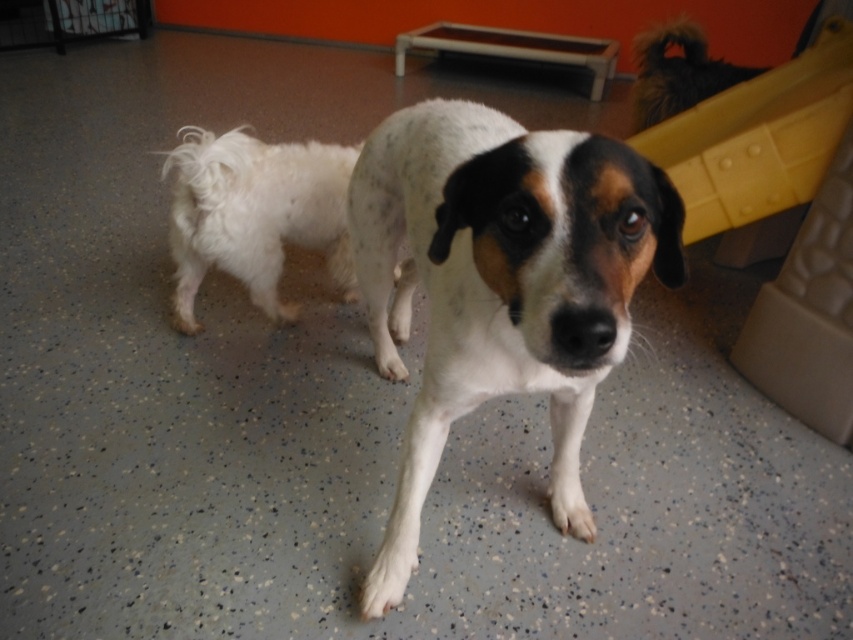
Who is higher up, white speckled fur dog at center or yellow plastic slide at upper right?

yellow plastic slide at upper right

Does point (463, 228) come behind point (776, 193)?

No.

Image resolution: width=853 pixels, height=640 pixels. Identify the location of white speckled fur dog at center. (500, 284).

Can you confirm if white fluffy dog at left is positioned to the left of yellow plastic slide at upper right?

Indeed, white fluffy dog at left is positioned on the left side of yellow plastic slide at upper right.

Who is taller, white fluffy dog at left or yellow plastic slide at upper right?

Standing taller between the two is yellow plastic slide at upper right.

Between point (242, 125) and point (718, 198), which one is positioned behind?

Positioned behind is point (242, 125).

What are the coordinates of `white fluffy dog at left` in the screenshot? It's located at (254, 212).

Is white speckled fur dog at center positioned at the back of white fluffy dog at left?

No, white speckled fur dog at center is closer to the viewer.

Identify the location of white speckled fur dog at center. The width and height of the screenshot is (853, 640). 500,284.